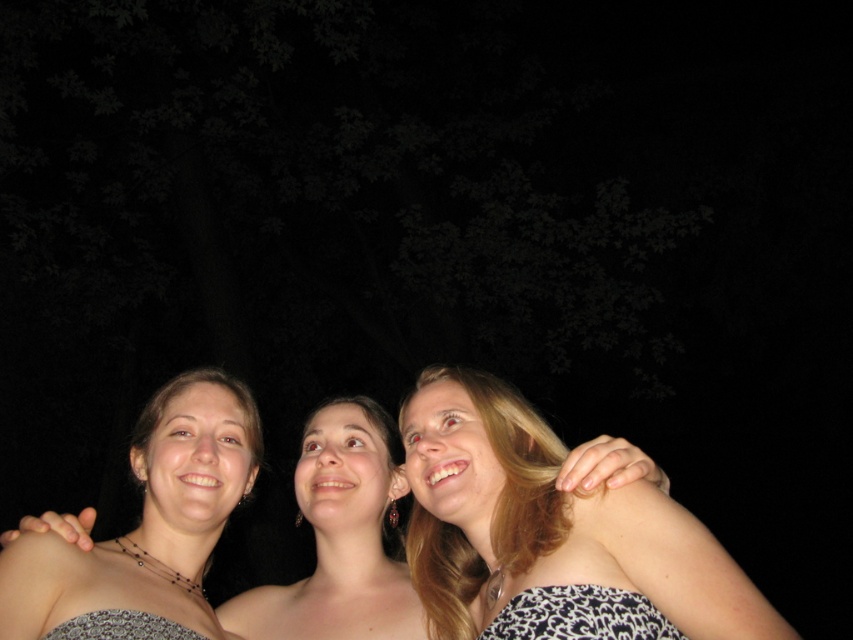
Question: Which point is closer to the camera?

Choices:
 (A) (183, 394)
 (B) (593, 557)
 (C) (122, 609)
 (D) (554, 624)

Answer: (D)

Question: Considering the real-world distances, which object is closest to the blonde hair at upper right?

Choices:
 (A) matte black dress at center
 (B) black printed dress at lower center
 (C) black printed dress at lower right

Answer: (C)

Question: Is black printed dress at lower right bigger than black printed dress at lower center?

Choices:
 (A) yes
 (B) no

Answer: (A)

Question: Which point is closer to the camera taking this photo?

Choices:
 (A) (593, 620)
 (B) (163, 630)
 (C) (581, 550)
 (D) (44, 560)

Answer: (A)

Question: From the image, what is the correct spatial relationship of matte black dress at center in relation to black printed dress at lower center?

Choices:
 (A) right
 (B) left

Answer: (B)

Question: Does black printed dress at lower right appear on the right side of black printed dress at lower center?

Choices:
 (A) yes
 (B) no

Answer: (A)